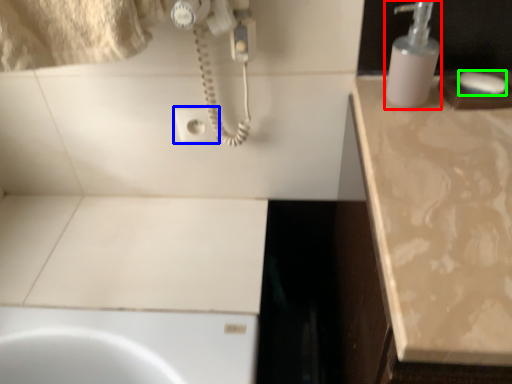
Question: Estimate the real-world distances between objects in this image. Which object is closer to soap dispenser (highlighted by a red box), electric outlet (highlighted by a blue box) or soap (highlighted by a green box)?

Choices:
 (A) electric outlet
 (B) soap

Answer: (B)